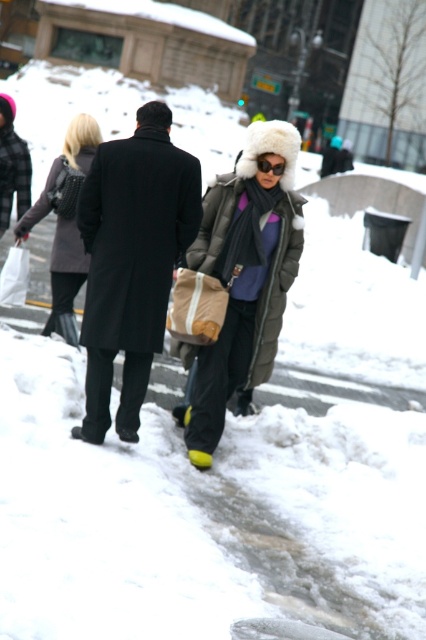
You are a photographer standing in the snowy scene. You want to take a photo of the matte green puffer coat at center and the matte black coat at upper left. Which coat should you focus on first to ensure both are in focus?

The matte green puffer coat at center is in front of the matte black coat at upper left. To ensure both are in focus, you should focus on the matte black coat at upper left first because it is further away, allowing the camera to capture the foreground and background within the depth of field.

Consider the image. You are a fashion designer observing the snowy scene. You notice the matte green puffer coat at center and the black matte sunglasses at center. Which item is positioned higher on the person?

The matte green puffer coat at center is much taller than the black matte sunglasses at center, so the coat is positioned higher on the person.